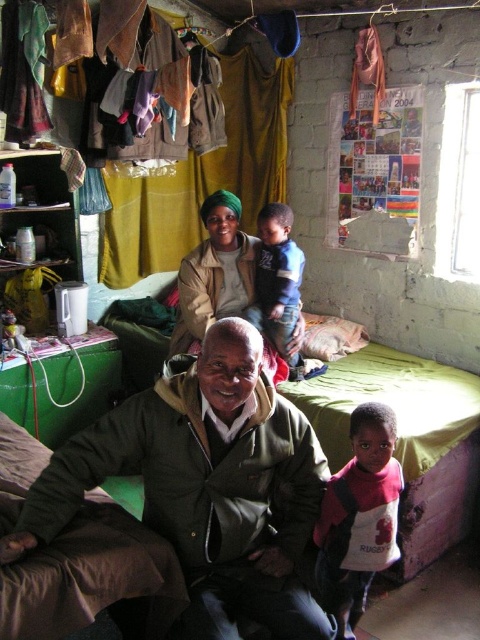
You are a delivery person who needs to place a small package between the green fabric bed at center and the matte beige jacket at center. The package is 50 centimeters long. Is there enough space between them to fit the package?

The distance between the green fabric bed at center and the matte beige jacket at center is 89.38 centimeters. Since the package is 50 centimeters long, there is sufficient space to place it between them.

You are a delivery person holding a package that requires a signature. You are in front of a brick wall room with a window. The package needs to be handed to the person closest to the dark green fabric at center. Who should you approach?

The dark green fabric at center is 4.16 feet away from the viewer. The older man sitting on the bed or low couch is closest to the dark green fabric at center, so you should approach him for the signature.

You are a photographer trying to capture a group photo of the family. You notice the green matte jacket at center and the blue cotton shirt at center. Which clothing item is closer to the camera?

The green matte jacket at center is positioned under the blue cotton shirt at center, meaning the blue cotton shirt at center is closer to the camera.